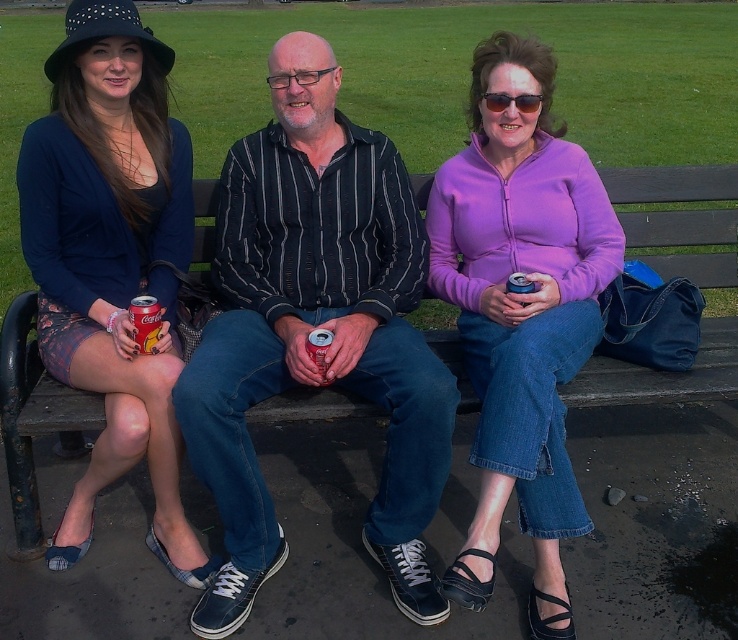
What are the coordinates of the matte red can at left?

The coordinates of the matte red can at left are at point (x=145, y=323).